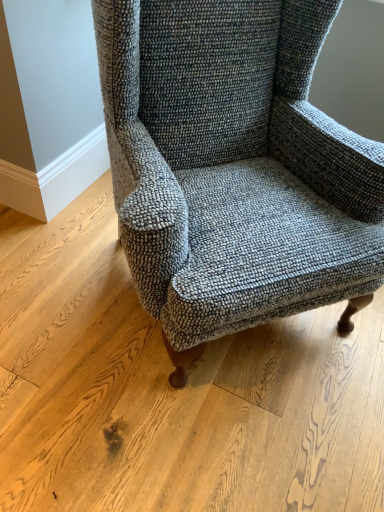
The image size is (384, 512). In order to click on free space in front of textured gray fabric chair at center in this screenshot , I will do `click(202, 431)`.